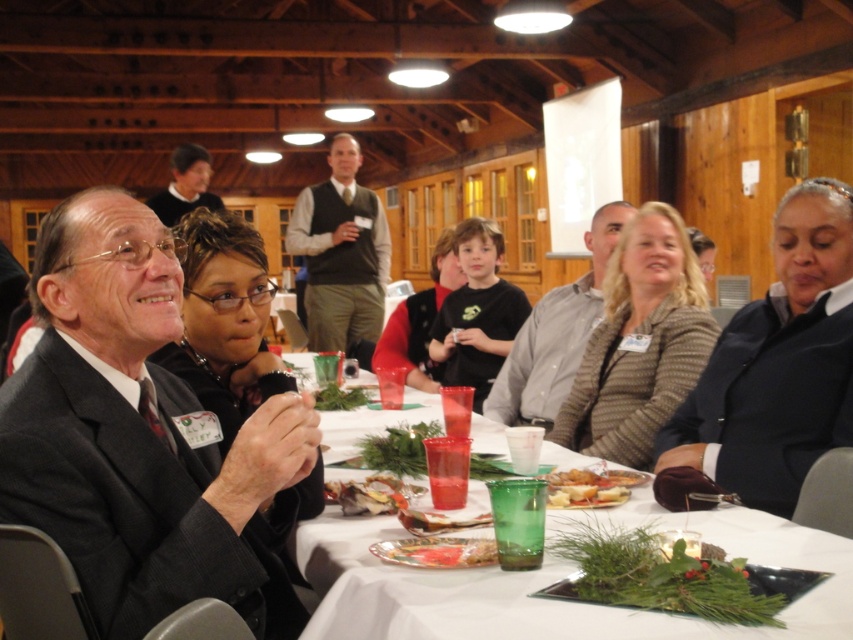
Question: Which point is farther to the camera?

Choices:
 (A) matte plastic sandwich at center
 (B) dark green sweater at center
 (C) green glass at center

Answer: (B)

Question: Which point is closer to the camera?

Choices:
 (A) green glass at center
 (B) green glass at table center
 (C) matte black sweater at upper left

Answer: (A)

Question: Can you confirm if matte plastic sandwich at center is positioned above green glass at table center?

Choices:
 (A) no
 (B) yes

Answer: (A)

Question: Can you confirm if green glass at center is bigger than gray shirt at center?

Choices:
 (A) no
 (B) yes

Answer: (A)

Question: Estimate the real-world distances between objects in this image. Which object is closer to the matte plastic sandwich at center?

Choices:
 (A) shiny metallic plate at center
 (B) dark green sweater at center
 (C) green leafy garnish at center
 (D) green glass at table center

Answer: (D)

Question: Is green glass at center positioned at the back of gray shirt at center?

Choices:
 (A) no
 (B) yes

Answer: (A)